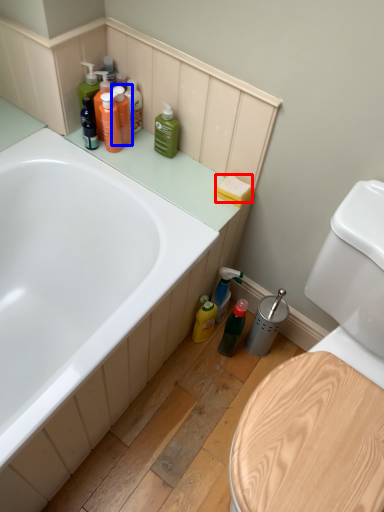
Question: Which object is closer to the camera taking this photo, toilet paper (highlighted by a red box) or cleaning product (highlighted by a blue box)?

Choices:
 (A) toilet paper
 (B) cleaning product

Answer: (A)